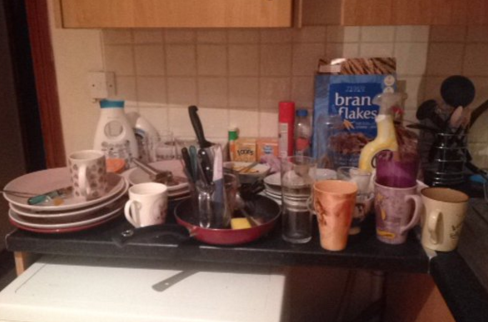
This screenshot has height=322, width=488. Identify the location of plastic cup. (395, 171).